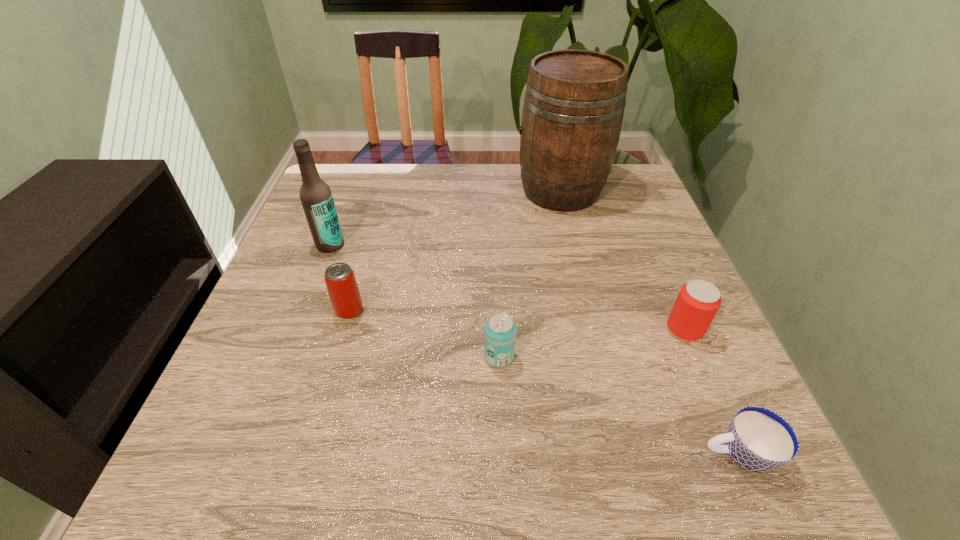
Locate an element on the screen. The image size is (960, 540). free space that is in between the rightmost beer can and the cider is located at coordinates (622, 260).

You are a GUI agent. You are given a task and a screenshot of the screen. Output one action in this format:
    pyautogui.click(x=<x>, y=<y>)
    Task: Click on the empty space that is in between the second object from left to right and the second beer can from right to left
    The height and width of the screenshot is (540, 960).
    Given the screenshot: What is the action you would take?
    pyautogui.click(x=424, y=334)

The height and width of the screenshot is (540, 960). In order to click on object that ranks as the second closest to the rightmost beer can in this screenshot , I will do `click(500, 329)`.

Image resolution: width=960 pixels, height=540 pixels. I want to click on the closest object relative to the second farthest object, so click(x=342, y=287).

The height and width of the screenshot is (540, 960). What are the coordinates of `the second closest beer can to the tallest object` in the screenshot? It's located at [x=500, y=329].

Choose which beer can is the second nearest neighbor to the rightmost beer can. Please provide its 2D coordinates. Your answer should be formatted as a tuple, i.e. [(x, y)], where the tuple contains the x and y coordinates of a point satisfying the conditions above.

[(342, 287)]

In order to click on free spot that satisfies the following two spatial constraints: 1. on the side of the rightmost beer can near the bung hole; 2. on the left side of the cider in this screenshot , I will do `click(593, 329)`.

At what (x,y) coordinates should I click in order to perform the action: click on free spot that satisfies the following two spatial constraints: 1. on the side of the nearest beer can with the label; 2. on the right side of the fifth shortest object. Please return your answer as a coordinate pair (x, y). Image resolution: width=960 pixels, height=540 pixels. Looking at the image, I should click on (288, 356).

I want to click on vacant region that satisfies the following two spatial constraints: 1. on the side of the farthest object near the bung hole; 2. on the side of the second farthest object with the label, so click(x=573, y=245).

This screenshot has height=540, width=960. In order to click on vacant region that satisfies the following two spatial constraints: 1. on the side of the rightmost beer can near the bung hole; 2. on the right side of the farthest object in this screenshot , I will do `click(593, 329)`.